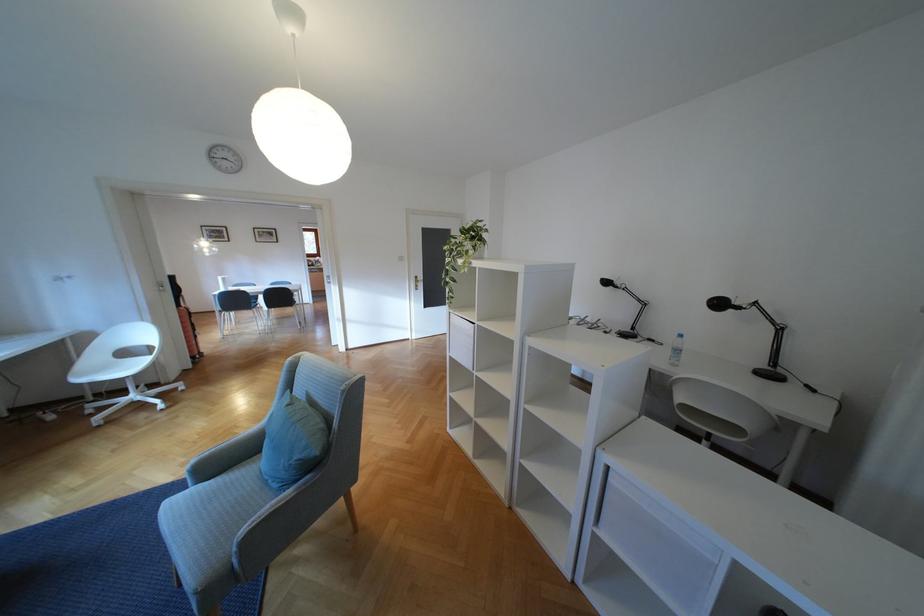
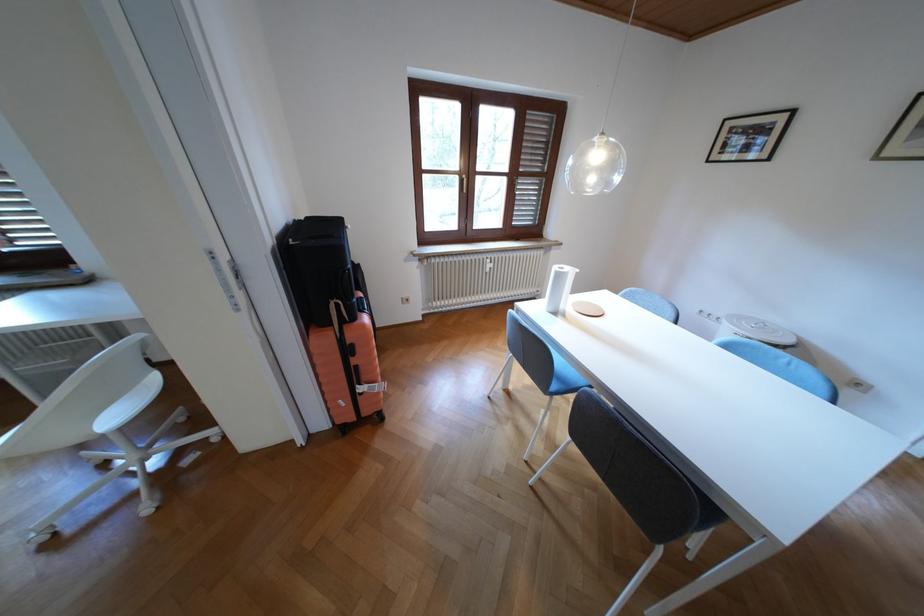
Where in the second image is the point corresponding to pixel 229 278 from the first image?

(565, 268)